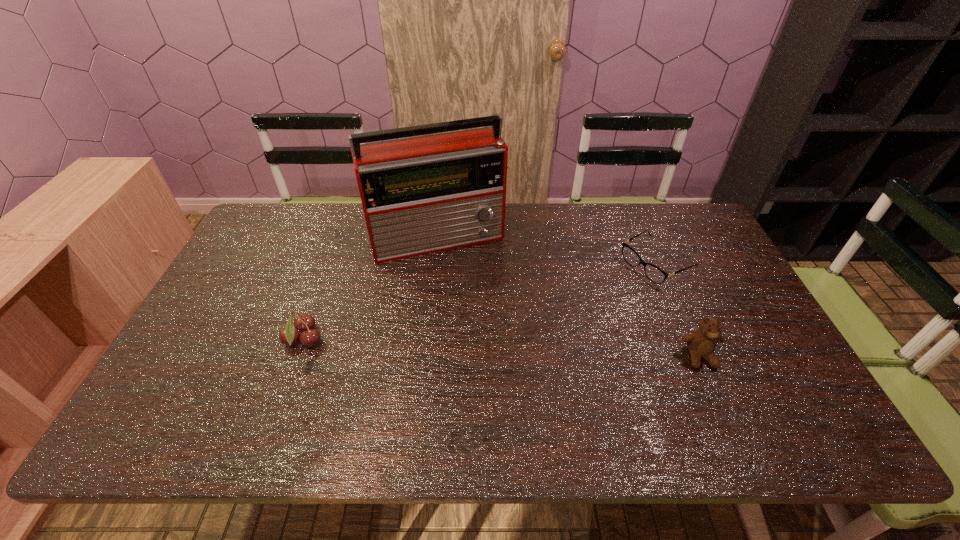
Locate an element on the screen. Image resolution: width=960 pixels, height=540 pixels. cherry is located at coordinates (304, 323).

You are a GUI agent. You are given a task and a screenshot of the screen. Output one action in this format:
    pyautogui.click(x=<x>, y=<y>)
    Task: Click on the second shortest object
    
    Given the screenshot: What is the action you would take?
    pyautogui.click(x=304, y=323)

You are a GUI agent. You are given a task and a screenshot of the screen. Output one action in this format:
    pyautogui.click(x=<x>, y=<y>)
    Task: Click on the teddy bear
    This screenshot has width=960, height=540.
    Given the screenshot: What is the action you would take?
    pyautogui.click(x=701, y=343)

Where is `the shortest object`? the shortest object is located at coordinates (655, 274).

This screenshot has height=540, width=960. Identify the location of the tallest object. (425, 194).

The image size is (960, 540). I want to click on radio receiver, so click(x=425, y=194).

What are the coordinates of `vacant point located on the leaves of the cherry` in the screenshot? It's located at (445, 340).

Where is `vacant space located at the face of the teddy bear`? The height and width of the screenshot is (540, 960). vacant space located at the face of the teddy bear is located at coordinates click(x=716, y=396).

The image size is (960, 540). Find the location of `free point located on the front-facing side of the spectacles`. free point located on the front-facing side of the spectacles is located at coordinates (608, 290).

Image resolution: width=960 pixels, height=540 pixels. What are the coordinates of `vacant space located 0.060m on the front-facing side of the spectacles` in the screenshot? It's located at (617, 285).